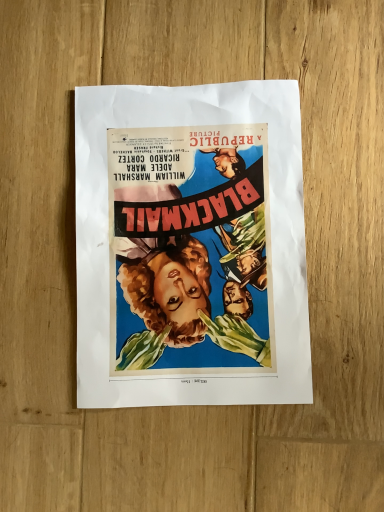
Find the location of a particular element. The image size is (384, 512). empty space that is ontop of matte paper poster at center is located at coordinates coord(191,243).